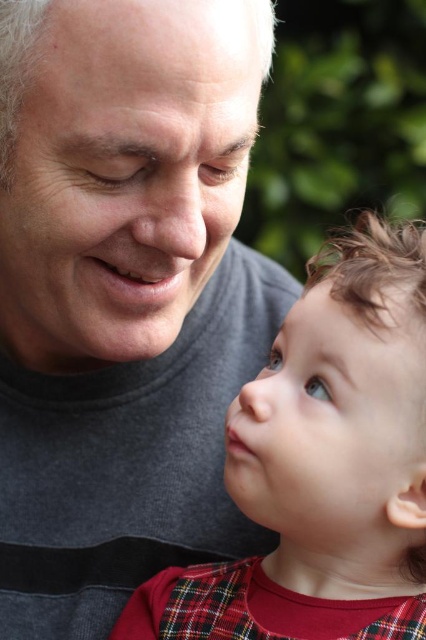
Who is higher up, plaid fabric baby at center or smooth skin nose at center?

smooth skin nose at center

Which is behind, point (382, 448) or point (285, 387)?

The point (285, 387) is behind.

Where is `plaid fabric baby at center`? The width and height of the screenshot is (426, 640). plaid fabric baby at center is located at coordinates (325, 467).

Can you confirm if smooth skin baby at center is bigger than smooth skin nose at center?

Yes, smooth skin baby at center is bigger than smooth skin nose at center.

Consider the image. Between smooth skin baby at center and smooth skin nose at center, which one is positioned higher?

Positioned higher is smooth skin nose at center.

Between point (350, 429) and point (253, 416), which one is positioned behind?

The point (253, 416) is more distant.

Where is `smooth skin baby at center`? smooth skin baby at center is located at coordinates (337, 428).

Which is more to the right, gray cotton t-shirt at upper left or matte gray face at upper left?

Positioned to the right is gray cotton t-shirt at upper left.

Looking at this image, which of these two, gray cotton t-shirt at upper left or matte gray face at upper left, stands taller?

gray cotton t-shirt at upper left

Does point (193, 243) come closer to viewer compared to point (103, 324)?

That is True.

Where is `gray cotton t-shirt at upper left`? The width and height of the screenshot is (426, 640). gray cotton t-shirt at upper left is located at coordinates (123, 296).